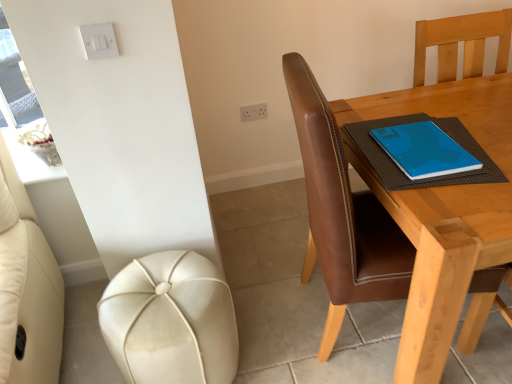
Where is `free space above blue matte notebook at upper right (from a real-world perspective)`? free space above blue matte notebook at upper right (from a real-world perspective) is located at coordinates (423, 149).